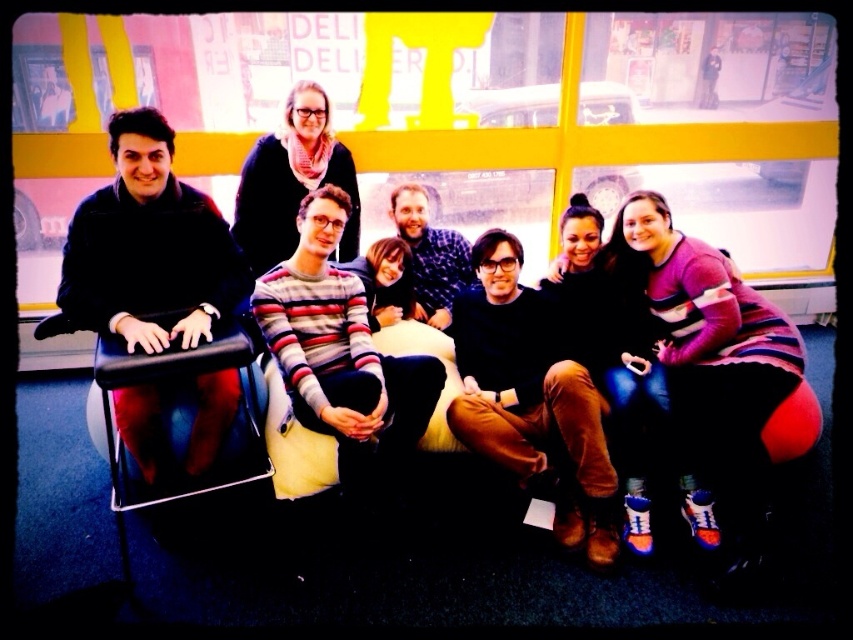
Does black leather chair at left appear over matte black sweater at upper center?

No, black leather chair at left is not above matte black sweater at upper center.

Based on the photo, measure the distance between black leather chair at left and matte black sweater at upper center.

black leather chair at left is 37.59 inches from matte black sweater at upper center.

This screenshot has width=853, height=640. Describe the element at coordinates (183, 419) in the screenshot. I see `black leather chair at left` at that location.

You are a GUI agent. You are given a task and a screenshot of the screen. Output one action in this format:
    pyautogui.click(x=<x>, y=<y>)
    Task: Click on the black leather chair at left
    This screenshot has width=853, height=640.
    Given the screenshot: What is the action you would take?
    pyautogui.click(x=183, y=419)